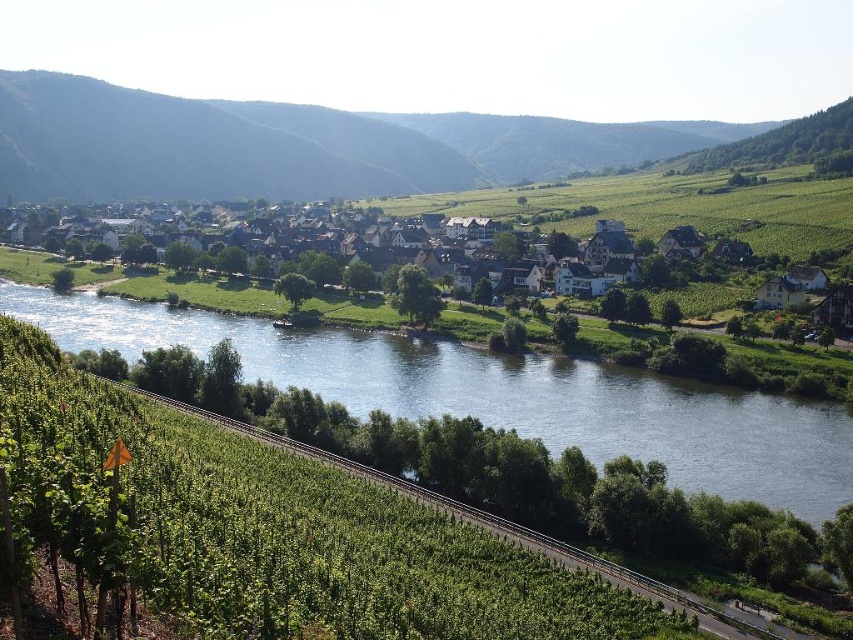
Question: Which object is closer to the camera taking this photo?

Choices:
 (A) green grassy hillside at upper left
 (B) white wooden houses at center

Answer: (B)

Question: Is green grassy river at center above white wooden houses at center?

Choices:
 (A) no
 (B) yes

Answer: (A)

Question: From the image, what is the correct spatial relationship of white wooden houses at center in relation to green grassy train track at lower left?

Choices:
 (A) above
 (B) below

Answer: (A)

Question: Is green grassy river at center below green grassy hillside at upper left?

Choices:
 (A) no
 (B) yes

Answer: (B)

Question: Which point is closer to the camera?

Choices:
 (A) green grassy river at center
 (B) white wooden houses at center
 (C) green grassy hillside at upper left
 (D) green grassy train track at lower left

Answer: (D)

Question: Which point is farther to the camera?

Choices:
 (A) (505, 404)
 (B) (497, 218)

Answer: (B)